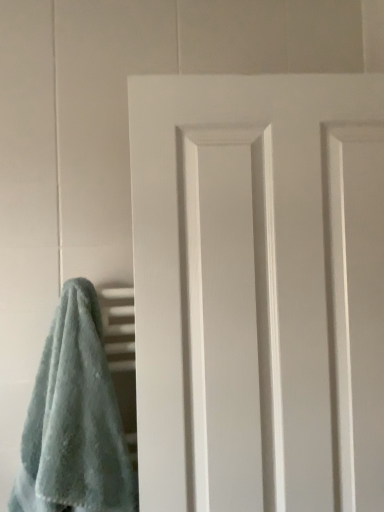
Question: Is soft blue towel at lower left wider or thinner than white matte door at center?

Choices:
 (A) wide
 (B) thin

Answer: (A)

Question: Relative to white matte door at center, is soft blue towel at lower left in front or behind?

Choices:
 (A) behind
 (B) front

Answer: (B)

Question: In terms of height, does soft blue towel at lower left look taller or shorter compared to white matte door at center?

Choices:
 (A) short
 (B) tall

Answer: (A)

Question: From their relative heights in the image, would you say white matte door at center is taller or shorter than soft blue towel at lower left?

Choices:
 (A) short
 (B) tall

Answer: (B)

Question: From the image's perspective, is white matte door at center located above or below soft blue towel at lower left?

Choices:
 (A) below
 (B) above

Answer: (B)

Question: Looking at their shapes, would you say white matte door at center is wider or thinner than soft blue towel at lower left?

Choices:
 (A) wide
 (B) thin

Answer: (B)

Question: Is white matte door at center bigger or smaller than soft blue towel at lower left?

Choices:
 (A) big
 (B) small

Answer: (A)